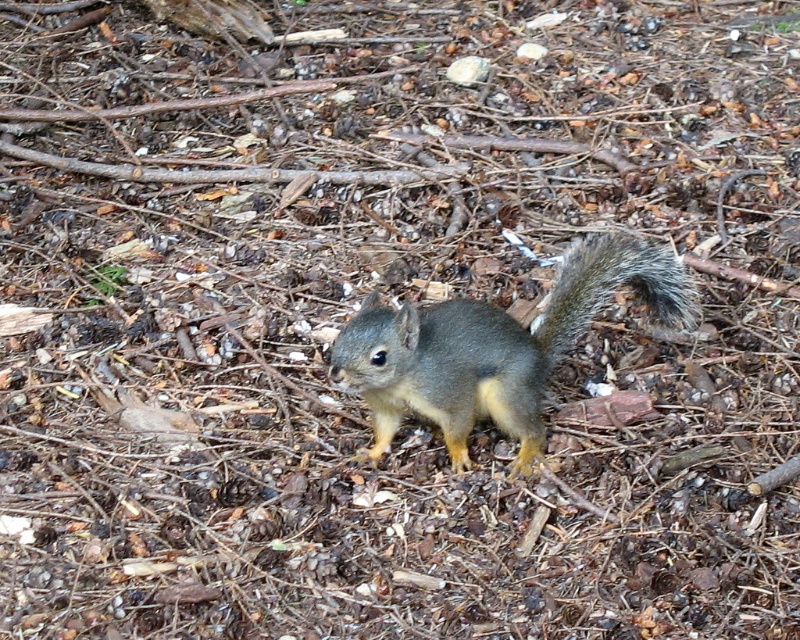
You are a hiker who has spotted a shiny gray squirrel at center. You want to take a photo of it without disturbing it. If you stay 5 feet away, will you be able to get a clear shot?

The shiny gray squirrel at center is 4.77 feet away from you, so staying 5 feet away would be slightly further than the distance to the squirrel. However, since the squirrel is at center, you might need to adjust your position to ensure it stays in frame. Alternatively, you could move closer to within 4.77 feet for a clearer shot without disturbing it.

You are a photographer trying to capture the squirrel in the image. You notice two points marked on the forest floor. The first point is at coordinate point(x=522, y=356) and the second is at point(x=564, y=337). If you want to place a camera closer to the squirrel without blocking the view of the second point, which coordinate should you choose?

You should choose point(x=522, y=356) because it is in front of point(x=564, y=337), so placing the camera there would keep it closer to the squirrel while avoiding blocking the view of the second point.

You are a photographer aiming to capture the shiny gray squirrel at center and its fuzzy brown tail at center in a single shot. Since the squirrel is moving, you need to focus on the area where both are visible. Based on their positions, where should you point your camera?

You should point your camera at the center of the image where the shiny gray squirrel at center is located because the fuzzy brown tail at center is positioned above it, ensuring both are visible in the same frame.